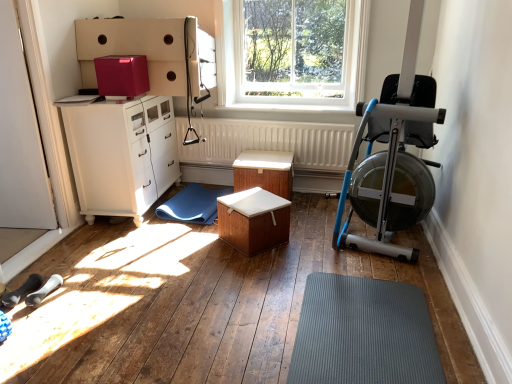
Image resolution: width=512 pixels, height=384 pixels. I want to click on free location to the right of wooden box at center, the 2th table positioned from the back, so click(x=307, y=245).